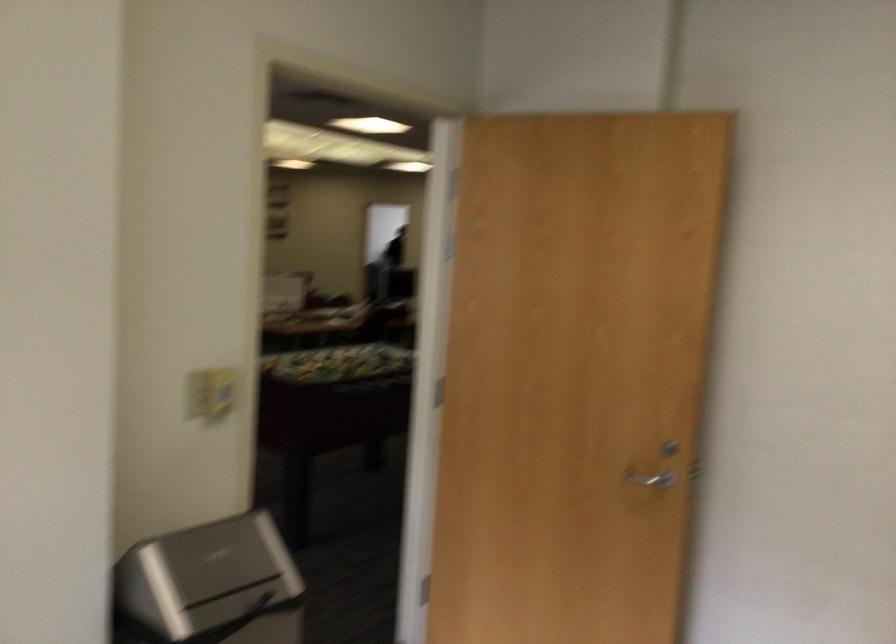
Locate an element on the screen. silver door handle is located at coordinates (655, 471).